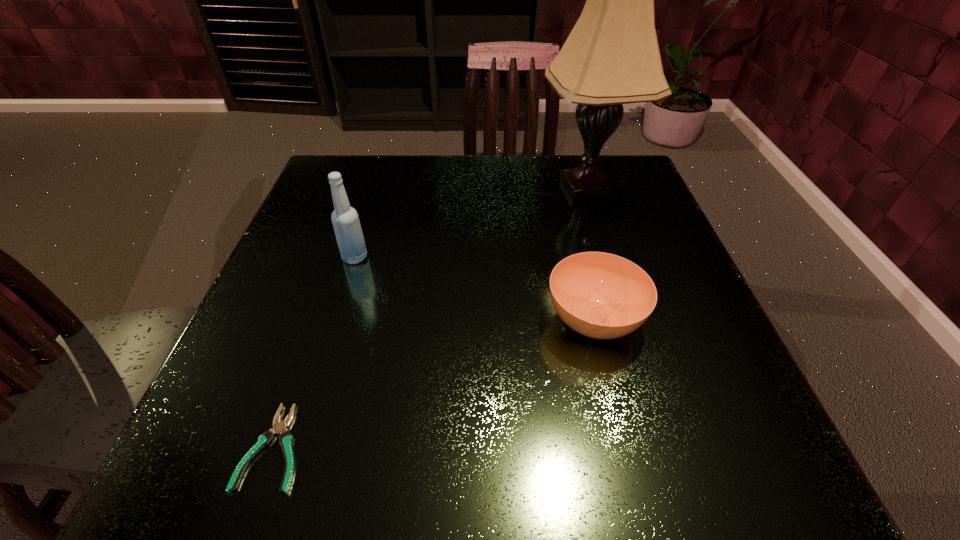
Locate an element on the screen. This screenshot has height=540, width=960. the farthest object is located at coordinates (611, 57).

Identify the location of the tallest object. Image resolution: width=960 pixels, height=540 pixels. (611, 57).

Locate an element on the screen. bottle is located at coordinates (345, 220).

Where is `the third nearest object`? the third nearest object is located at coordinates (345, 220).

At what (x,y) coordinates should I click in order to perform the action: click on soup bowl. Please return your answer as a coordinate pair (x, y). This screenshot has width=960, height=540. Looking at the image, I should click on (604, 296).

This screenshot has height=540, width=960. Find the location of `the third farthest object`. the third farthest object is located at coordinates (604, 296).

Identify the location of the nearest object. (279, 427).

Where is `pliers`? Image resolution: width=960 pixels, height=540 pixels. pliers is located at coordinates (279, 427).

At what (x,y) coordinates should I click in order to perform the action: click on vacant area located 0.110m on the front of the farthest object. Please return your answer as a coordinate pair (x, y). The image size is (960, 540). Looking at the image, I should click on (605, 249).

Where is `free location located on the back of the bottle`? This screenshot has width=960, height=540. free location located on the back of the bottle is located at coordinates (376, 189).